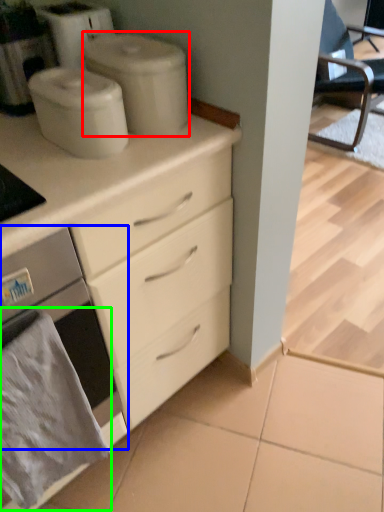
Question: Which object is positioned closest to appliance (highlighted by a red box)? Select from home appliance (highlighted by a blue box) and material (highlighted by a green box).

Choices:
 (A) home appliance
 (B) material

Answer: (A)